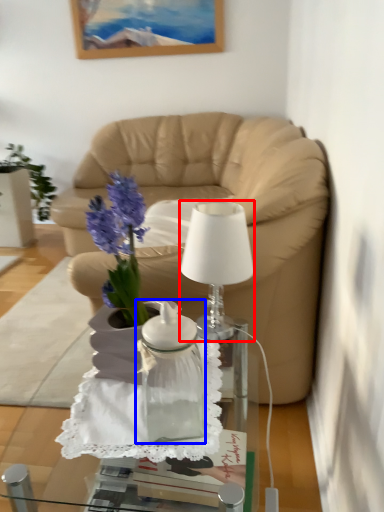
Question: Which object appears farthest to the camera in this image, lamp (highlighted by a red box) or vase (highlighted by a blue box)?

Choices:
 (A) lamp
 (B) vase

Answer: (A)